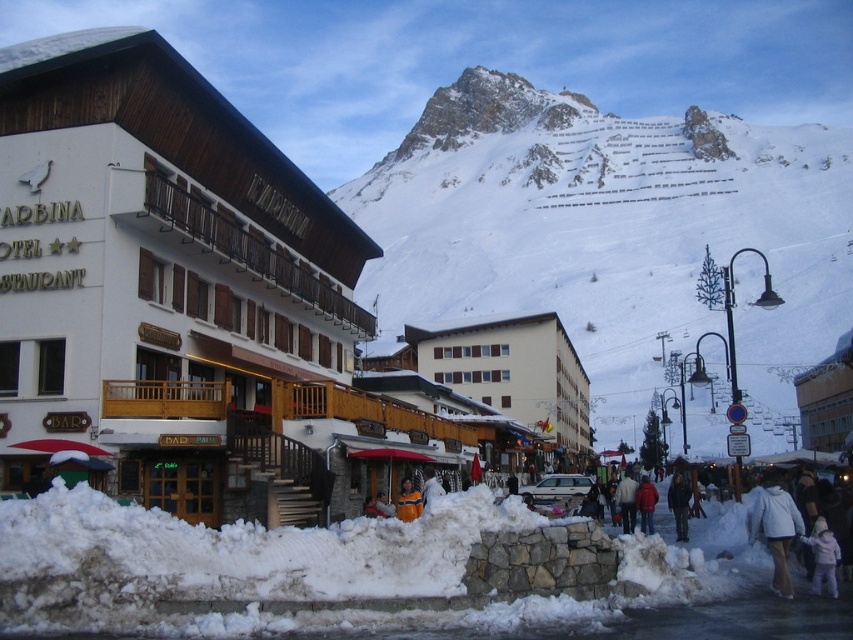
Question: From the image, what is the correct spatial relationship of red woolen jacket at lower right in relation to white fabric bag at center?

Choices:
 (A) below
 (B) above

Answer: (A)

Question: Which object is closer to the camera taking this photo?

Choices:
 (A) light pink fabric coat at lower right
 (B) white fabric bag at center
 (C) snowy rock at upper center

Answer: (A)

Question: Does white wool coat at center appear over orange fabric person at center?

Choices:
 (A) no
 (B) yes

Answer: (A)

Question: Which object is farther from the camera taking this photo?

Choices:
 (A) orange fabric person at center
 (B) snowy rock at upper center

Answer: (B)

Question: Is dark blue jacket at lower right further to the viewer compared to white wool coat at center?

Choices:
 (A) no
 (B) yes

Answer: (A)

Question: Which of the following is the farthest from the observer?

Choices:
 (A) white fleece jacket at lower right
 (B) white wool coat at center
 (C) white fabric bag at center
 (D) white wooden hotel at left

Answer: (B)